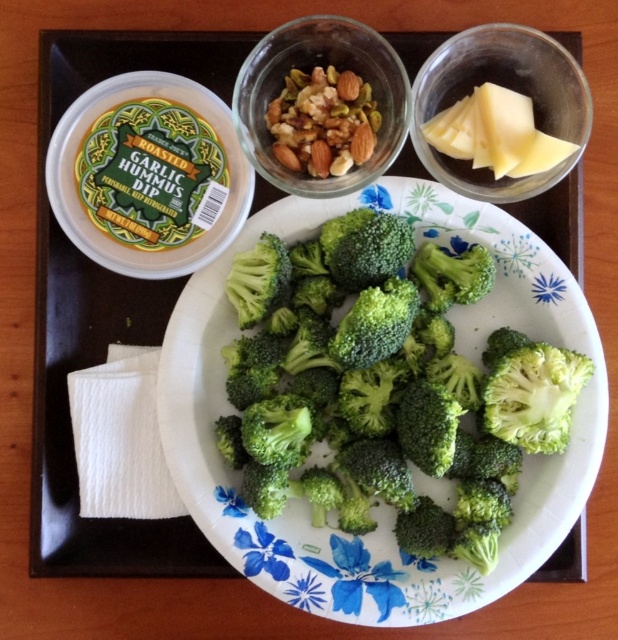
You are a food critic standing at the edge of the table. You see a point marked at coordinate (384, 381). Which object does this point lie on?

The point at coordinate (384, 381) lies on the green fresh broccoli at center.

You are standing at the point closest to the broccoli florets on the plate. Which of the two points, point (156, 140) or point (544, 108), is farther away from you?

Point (156, 140) is farther away from you because it is behind point (544, 108), meaning the latter is closer to your position.

You are a guest at a dinner party and see the shiny glass bowl at upper center and the shiny brown nuts at center on the table. Which item is positioned higher up on the table?

The shiny glass bowl at upper center is located above the shiny brown nuts at center, so it is positioned higher up on the table.